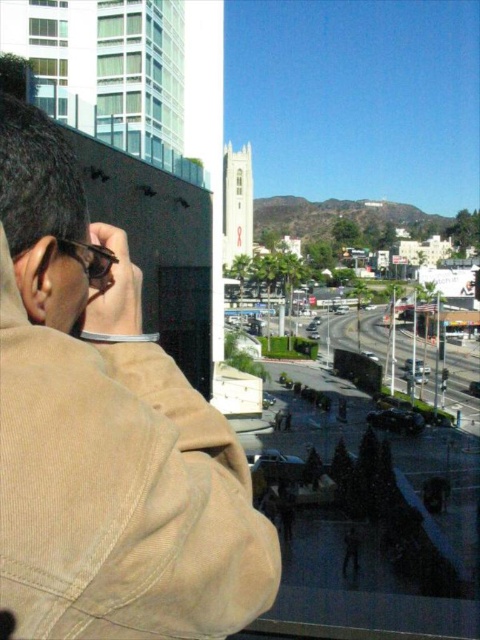
Question: Can you confirm if tan corduroy trench coat at upper left is wider than clear glass window at upper left?

Choices:
 (A) no
 (B) yes

Answer: (B)

Question: Which point is farther from the camera taking this photo?

Choices:
 (A) (28, 1)
 (B) (212, 596)

Answer: (A)

Question: Which object is the closest to the clear glass window at upper left?

Choices:
 (A) green glass window at upper left
 (B) tan corduroy trench coat at upper left

Answer: (A)

Question: Is tan corduroy trench coat at upper left smaller than clear glass window at upper left?

Choices:
 (A) yes
 (B) no

Answer: (B)

Question: Estimate the real-world distances between objects in this image. Which object is closer to the clear glass window at upper left?

Choices:
 (A) green glass window at upper left
 (B) tan corduroy trench coat at upper left

Answer: (A)

Question: Observing the image, what is the correct spatial positioning of tan corduroy trench coat at upper left in reference to green glass window at upper left?

Choices:
 (A) above
 (B) below

Answer: (B)